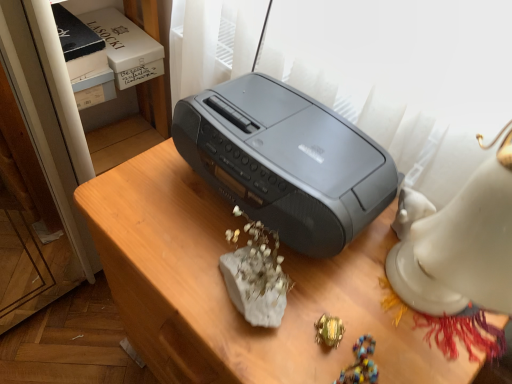
Identify the location of unoccupied space behind green metallic ring at lower center. (336, 266).